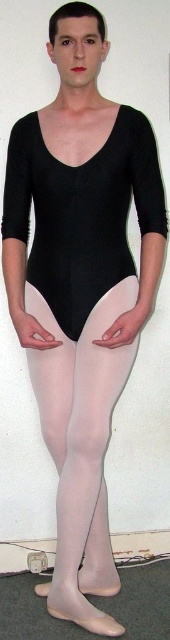
You are a costume designer preparing for a dance performance. You need to ensure that the costume pieces are arranged properly. Given the image of the person wearing the black matte leotard at center and the sheer white tights at center, which clothing item is positioned higher on the body?

The black matte leotard at center is located above the sheer white tights at center, so the leotard is positioned higher on the body.

You are a costume designer preparing for a dance performance. You need to ensure that the costume layers are arranged correctly according to the design. Based on the image, which object is layered in front of the other between the black matte leotard at center and the sheer white tights at center?

The black matte leotard at center is layered in front of the sheer white tights at center.

You are a photographer setting up for a photoshoot. You need to position the camera so that the black matte leotard at center is in focus. Given that the camera has a depth of field that can sharply focus objects within 1.5 meters, will the leotard be in focus?

The black matte leotard at center is 1.44 meters away from the camera, which is within the 1.5 meters depth of field range. Therefore, the leotard will be in focus.